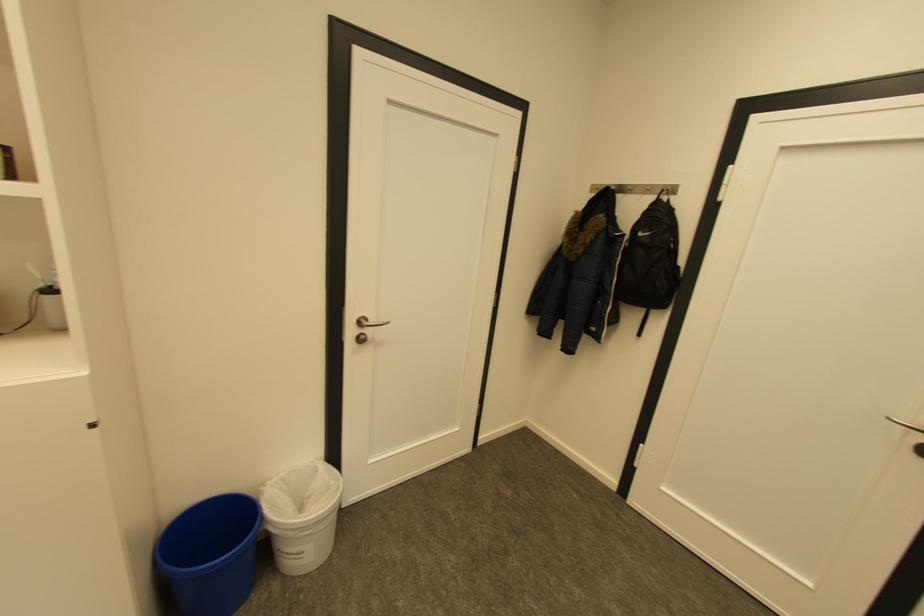
Describe the element at coordinates (638, 188) in the screenshot. I see `the coat rack hooks` at that location.